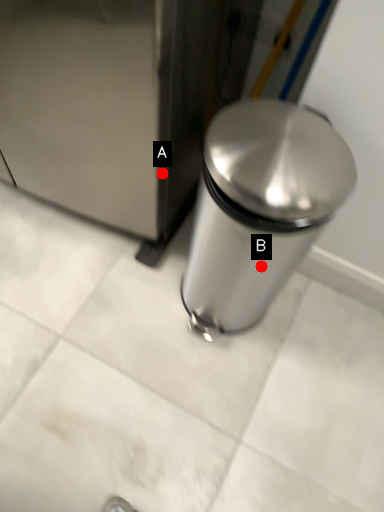
Question: Two points are circled on the image, labeled by A and B beside each circle. Which of the following is the closest to the observer?

Choices:
 (A) A is closer
 (B) B is closer

Answer: (B)